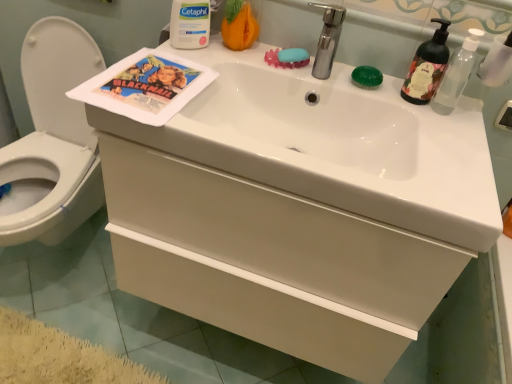
At what (x,y) coordinates should I click in order to perform the action: click on vacant area that lies between silver metallic faucet at upper center and green matte soap at upper right, acting as the second soap starting from the left. Please return your answer as a coordinate pair (x, y). This screenshot has height=384, width=512. Looking at the image, I should click on (351, 83).